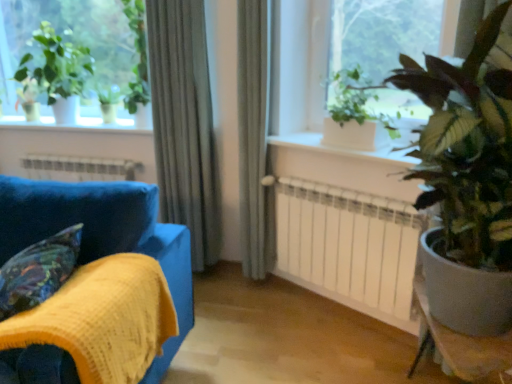
Question: Visually, is white matte radiator at center positioned to the left or to the right of green glossy plant at right, the third houseplant viewed from the left?

Choices:
 (A) left
 (B) right

Answer: (A)

Question: Is white matte radiator at center inside the boundaries of green glossy plant at right, the third houseplant viewed from the back, or outside?

Choices:
 (A) outside
 (B) inside

Answer: (A)

Question: Considering the real-world distances, which object is closest to the velvet-like multicolored pillow at lower left?

Choices:
 (A) smooth gray table at lower right
 (B) green matte plant at upper left, arranged as the third houseplant when viewed from the front
 (C) satin fabric curtain at center, positioned as the first curtain in right-to-left order
 (D) green leafy plant at upper right
 (E) white metallic heater at lower center

Answer: (C)

Question: Which object is positioned farthest from the white matte radiator at center?

Choices:
 (A) smooth gray table at lower right
 (B) green matte plant at upper right, placed as the second houseplant when sorted from left to right
 (C) white smooth window sill at center
 (D) green matte plant at upper left, the first houseplant in the back-to-front sequence
 (E) silky gray curtain at center, placed as the 1th curtain when sorted from left to right

Answer: (D)